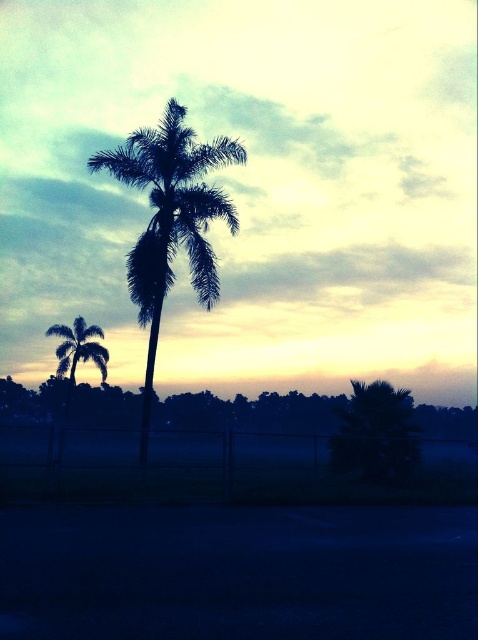
Based on the photo, you are standing in the scene and want to place a small flag at each of the two points, point [133,284] and point [359,451]. Which point is closer to you so that I can place the flag first?

Point [133,284] is further to the camera than point [359,451], so the point closer to you is point [359,451]. Place the flag there first.

You are standing in front of the two silhouette leafy palms. Which one is closer to you, the silhouette leafy palm at center or the silhouette leafy palm at left?

The silhouette leafy palm at center is closer to you because it is in front of the silhouette leafy palm at left.